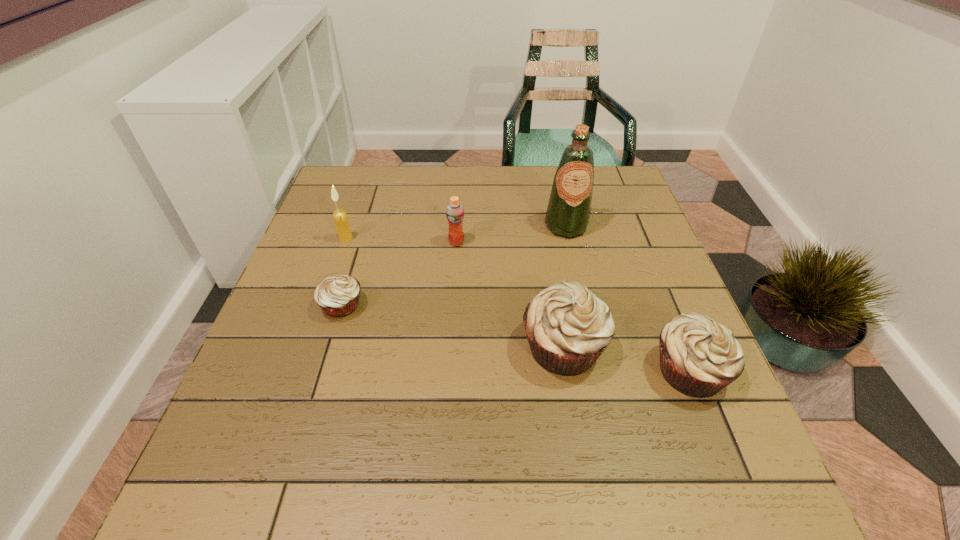
Find the location of a particular element. The width and height of the screenshot is (960, 540). vacant space at the far edge is located at coordinates (451, 192).

Identify the location of vacant space at the near edge of the desktop. The image size is (960, 540). (378, 409).

Locate an element on the screen. The width and height of the screenshot is (960, 540). free region at the left edge of the desktop is located at coordinates (244, 386).

Where is `vacant area at the right edge of the desktop`? The image size is (960, 540). vacant area at the right edge of the desktop is located at coordinates (660, 301).

The height and width of the screenshot is (540, 960). I want to click on vacant position at the far left corner of the desktop, so click(x=367, y=191).

Image resolution: width=960 pixels, height=540 pixels. In the image, there is a desktop. Identify the location of vacant region at the near left corner. (228, 446).

Identify the location of free space at the far right corner of the desktop. (606, 193).

Where is `free space between the shortest muffin and the second muffin from left to right`? free space between the shortest muffin and the second muffin from left to right is located at coordinates (452, 326).

At what (x,y) coordinates should I click in order to perform the action: click on free area in between the tallest object and the orange juice. Please return your answer as a coordinate pair (x, y). Image resolution: width=960 pixels, height=540 pixels. Looking at the image, I should click on (512, 234).

Where is `free space between the rightmost object and the olive oil`? Image resolution: width=960 pixels, height=540 pixels. free space between the rightmost object and the olive oil is located at coordinates (628, 299).